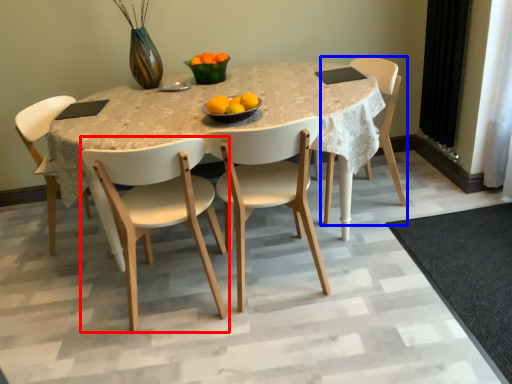
Question: Among these objects, which one is farthest to the camera, chair (highlighted by a red box) or chair (highlighted by a blue box)?

Choices:
 (A) chair
 (B) chair

Answer: (B)